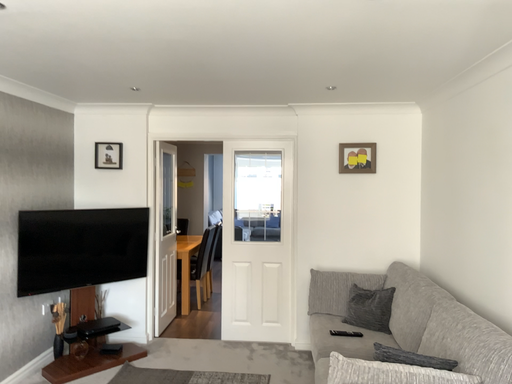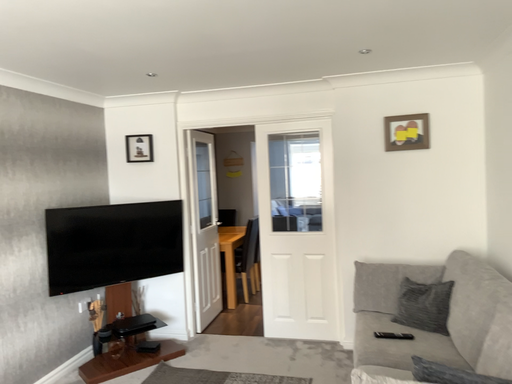
Question: Which way did the camera rotate in the video?

Choices:
 (A) rotated left
 (B) rotated right

Answer: (A)